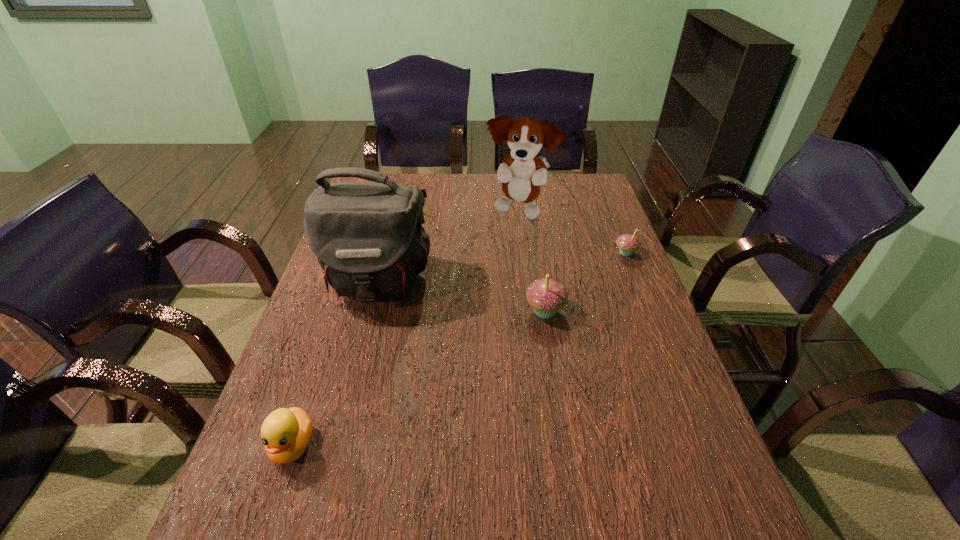
Please point a free position for a cupcake on the left. Please provide its 2D coordinates. Your answer should be formatted as a tuple, i.e. [(x, y)], where the tuple contains the x and y coordinates of a point satisfying the conditions above.

[(434, 392)]